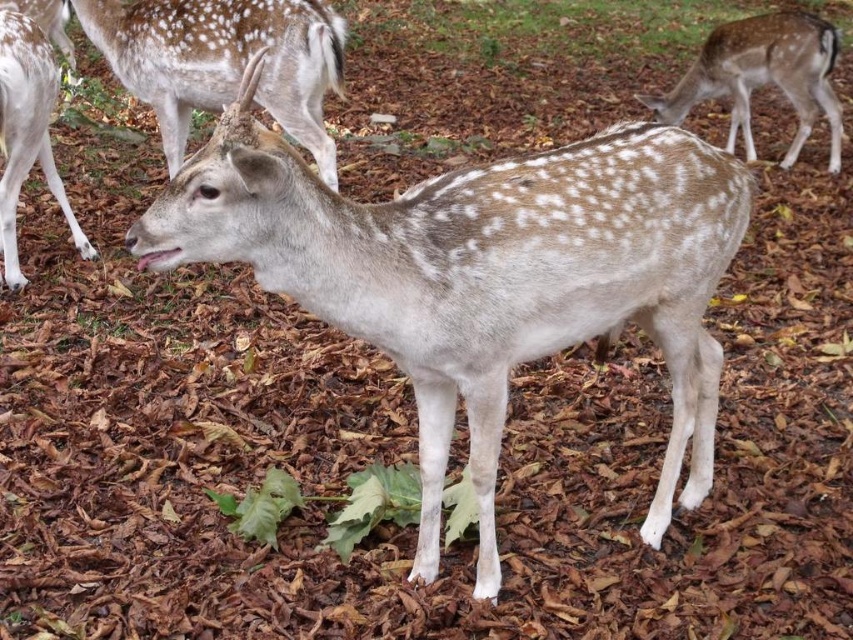
Question: Can you confirm if speckled fur deer at center is positioned above speckled fur deer at upper right?

Choices:
 (A) no
 (B) yes

Answer: (A)

Question: Is speckled fur deer at center to the right of spotted fur at left from the viewer's perspective?

Choices:
 (A) no
 (B) yes

Answer: (B)

Question: Which point is closer to the camera taking this photo?

Choices:
 (A) (728, 86)
 (B) (498, 291)
 (C) (166, 99)

Answer: (B)

Question: Which object is the farthest from the speckled fur deer at upper right?

Choices:
 (A) speckled fur antlers at upper left
 (B) spotted fur at left
 (C) speckled fur deer at center

Answer: (C)

Question: Which of the following is the closest to the observer?

Choices:
 (A) speckled fur antlers at upper left
 (B) speckled fur deer at center

Answer: (B)

Question: Is speckled fur deer at center behind spotted fur at left?

Choices:
 (A) yes
 (B) no

Answer: (B)